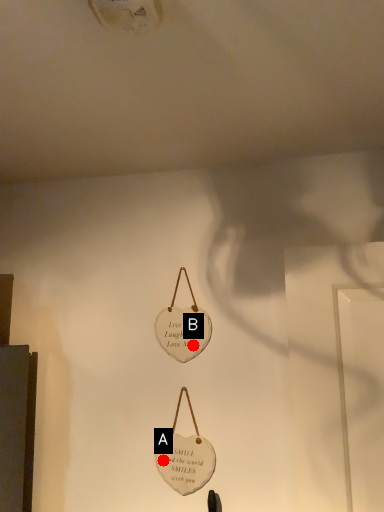
Question: Two points are circled on the image, labeled by A and B beside each circle. Which point appears closest to the camera in this image?

Choices:
 (A) A is closer
 (B) B is closer

Answer: (A)